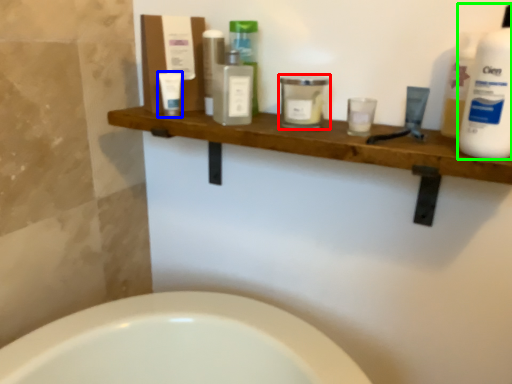
Question: Which object is positioned closest to toiletry (highlighted by a red box)? Select from toiletry (highlighted by a blue box) and cleaning product (highlighted by a green box).

Choices:
 (A) toiletry
 (B) cleaning product

Answer: (A)